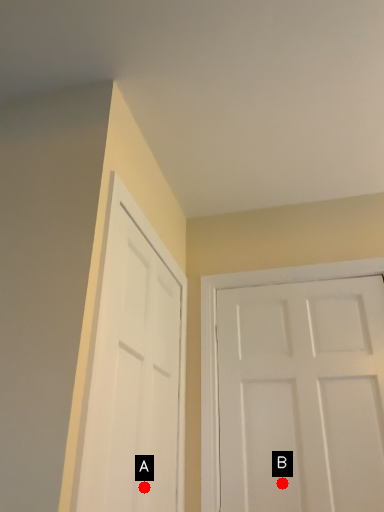
Question: Two points are circled on the image, labeled by A and B beside each circle. Which point is farther to the camera?

Choices:
 (A) A is further
 (B) B is further

Answer: (B)